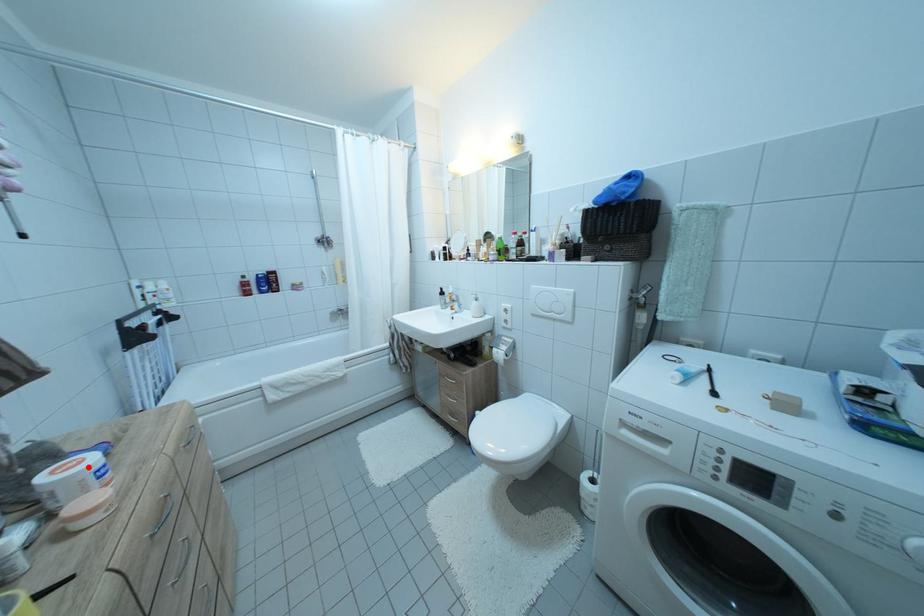
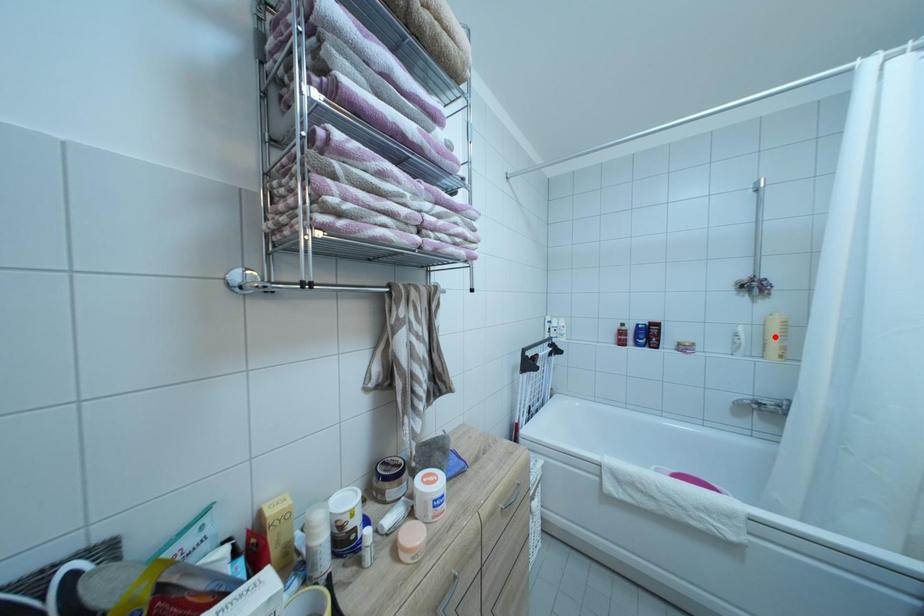
I am providing you with two images of the same scene from different viewpoints. A red point is marked on the first image and another point is marked on the second image. Are the points marked in image1 and image2 representing the same 3D position?

No